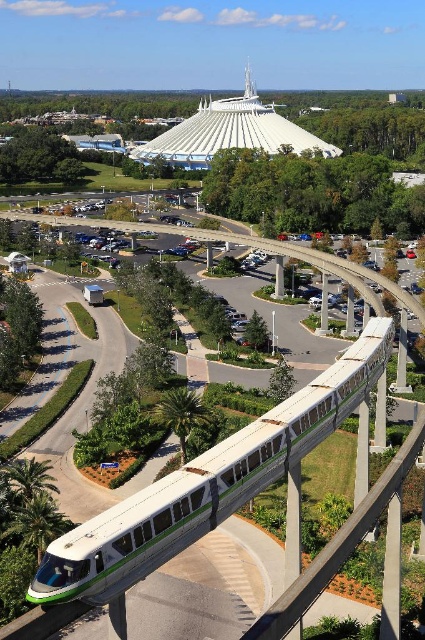
Question: Is green matte monorail at center to the right of white smooth dome at upper center from the viewer's perspective?

Choices:
 (A) no
 (B) yes

Answer: (B)

Question: Can you confirm if green matte monorail at center is positioned below white smooth dome at upper center?

Choices:
 (A) no
 (B) yes

Answer: (B)

Question: Which point is closer to the camera?

Choices:
 (A) (207, 109)
 (B) (295, 396)

Answer: (B)

Question: Which of the following is the farthest from the observer?

Choices:
 (A) green matte monorail at center
 (B) white smooth dome at upper center

Answer: (B)

Question: Is green matte monorail at center wider than white smooth dome at upper center?

Choices:
 (A) no
 (B) yes

Answer: (A)

Question: Which of the following is the closest to the observer?

Choices:
 (A) white smooth dome at upper center
 (B) green matte monorail at center

Answer: (B)